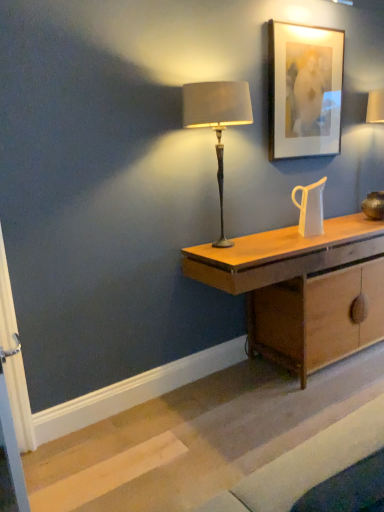
Question: Is matte wooden picture frame at upper right positioned far away from wooden desk at center?

Choices:
 (A) yes
 (B) no

Answer: (B)

Question: From a real-world perspective, is matte wooden picture frame at upper right below wooden desk at center?

Choices:
 (A) yes
 (B) no

Answer: (B)

Question: Does matte wooden picture frame at upper right have a smaller size compared to wooden desk at center?

Choices:
 (A) no
 (B) yes

Answer: (B)

Question: Can wooden desk at center be found inside matte wooden picture frame at upper right?

Choices:
 (A) no
 (B) yes

Answer: (A)

Question: Is matte wooden picture frame at upper right shorter than wooden desk at center?

Choices:
 (A) no
 (B) yes

Answer: (A)

Question: From a real-world perspective, is matte beige fabric lampshade at center physically located above or below matte wooden picture frame at upper right?

Choices:
 (A) below
 (B) above

Answer: (A)

Question: In terms of width, does matte beige fabric lampshade at center look wider or thinner when compared to matte wooden picture frame at upper right?

Choices:
 (A) thin
 (B) wide

Answer: (B)

Question: Do you think matte beige fabric lampshade at center is within matte wooden picture frame at upper right, or outside of it?

Choices:
 (A) inside
 (B) outside

Answer: (B)

Question: Is matte beige fabric lampshade at center bigger or smaller than matte wooden picture frame at upper right?

Choices:
 (A) big
 (B) small

Answer: (A)

Question: Is transparent glass jug at center in front of or behind matte beige fabric lampshade at center in the image?

Choices:
 (A) front
 (B) behind

Answer: (B)

Question: Is point (302, 210) closer or farther from the camera than point (223, 125)?

Choices:
 (A) farther
 (B) closer

Answer: (A)

Question: Would you say transparent glass jug at center is to the left or to the right of matte beige fabric lampshade at center in the picture?

Choices:
 (A) right
 (B) left

Answer: (A)

Question: Considering the positions of transparent glass jug at center and matte beige fabric lampshade at center in the image, is transparent glass jug at center wider or thinner than matte beige fabric lampshade at center?

Choices:
 (A) wide
 (B) thin

Answer: (B)

Question: Considering the positions of transparent glass jug at center and matte wooden picture frame at upper right in the image, is transparent glass jug at center bigger or smaller than matte wooden picture frame at upper right?

Choices:
 (A) big
 (B) small

Answer: (B)

Question: From the image's perspective, relative to matte wooden picture frame at upper right, is transparent glass jug at center above or below?

Choices:
 (A) below
 (B) above

Answer: (A)